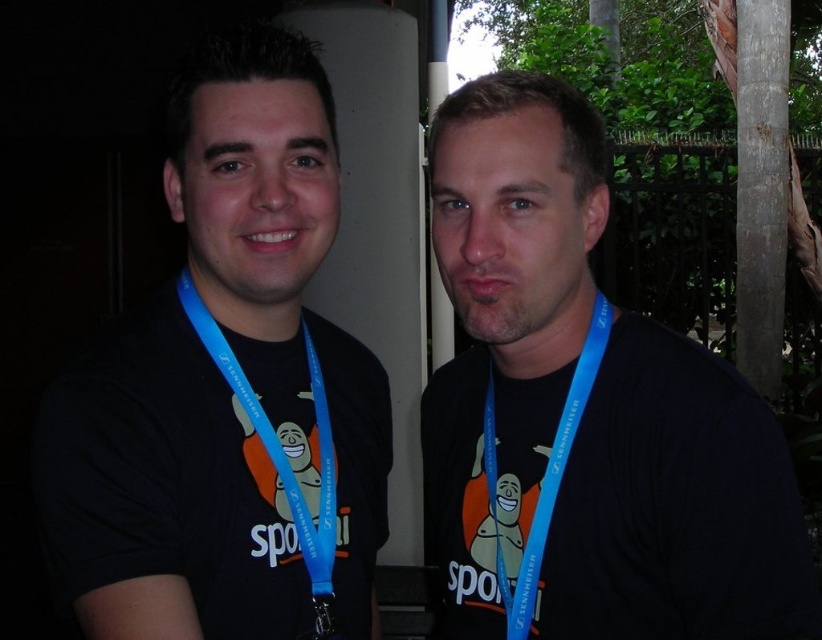
Consider the image. Who is positioned more to the right, blue fabric lanyard at center or blue lanyard at left?

blue fabric lanyard at center is more to the right.

Can you confirm if blue fabric lanyard at center is positioned above blue lanyard at left?

No, blue fabric lanyard at center is not above blue lanyard at left.

Locate an element on the screen. The width and height of the screenshot is (822, 640). blue fabric lanyard at center is located at coordinates (543, 474).

Find the location of a particular element. blue fabric lanyard at center is located at coordinates tap(543, 474).

Is black matte t-shirt at left taller than blue fabric lanyard at left?

Correct, black matte t-shirt at left is much taller as blue fabric lanyard at left.

Does point (224, 99) come closer to viewer compared to point (328, 518)?

Yes, it is.

Who is more distant from viewer, [245,490] or [317,616]?

The point [317,616] is more distant.

Image resolution: width=822 pixels, height=640 pixels. I want to click on black matte t-shirt at left, so click(x=224, y=384).

Who is positioned more to the left, black matte t-shirt at left or matte blue lanyard at center?

black matte t-shirt at left is more to the left.

Which is above, black matte t-shirt at left or matte blue lanyard at center?

Positioned higher is matte blue lanyard at center.

The height and width of the screenshot is (640, 822). What are the coordinates of `black matte t-shirt at left` in the screenshot? It's located at (224, 384).